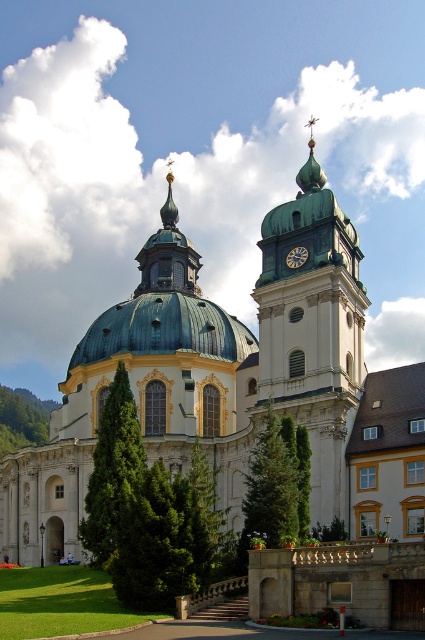
The height and width of the screenshot is (640, 425). What do you see at coordinates (207, 371) in the screenshot? I see `green dome at center` at bounding box center [207, 371].

Is green dome at center behind gold metallic clock at center?

No, it is in front of gold metallic clock at center.

Which is behind, point (240, 524) or point (306, 257)?

Positioned behind is point (306, 257).

Locate an element on the screen. Image resolution: width=425 pixels, height=640 pixels. green dome at center is located at coordinates point(207,371).

Is green copper bell tower at center closer to the viewer compared to gold metallic clock at center?

Yes, green copper bell tower at center is closer to the viewer.

Who is shorter, green copper bell tower at center or gold metallic clock at center?

Standing shorter between the two is gold metallic clock at center.

Is point (274, 282) in front of point (297, 264)?

Yes, it is in front of point (297, 264).

Where is `green copper bell tower at center`? Image resolution: width=425 pixels, height=640 pixels. green copper bell tower at center is located at coordinates (312, 326).

Can you confirm if green dome at center is thinner than green copper bell tower at center?

Incorrect, green dome at center's width is not less than green copper bell tower at center's.

Between green dome at center and green copper bell tower at center, which one is positioned higher?

Positioned higher is green copper bell tower at center.

Between point (190, 349) and point (317, 506), which one is positioned in front?

Point (317, 506)

Locate an element on the screen. The height and width of the screenshot is (640, 425). green dome at center is located at coordinates (207, 371).